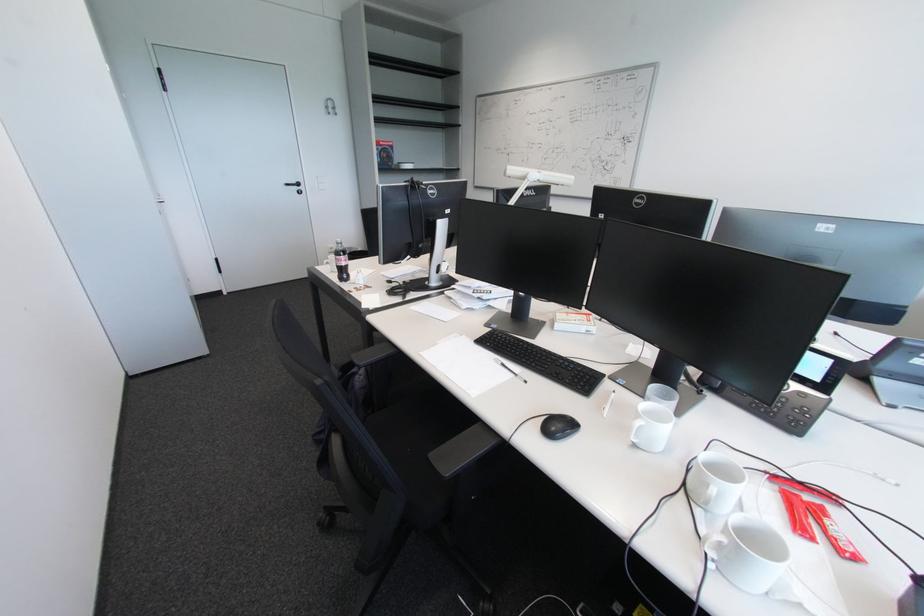
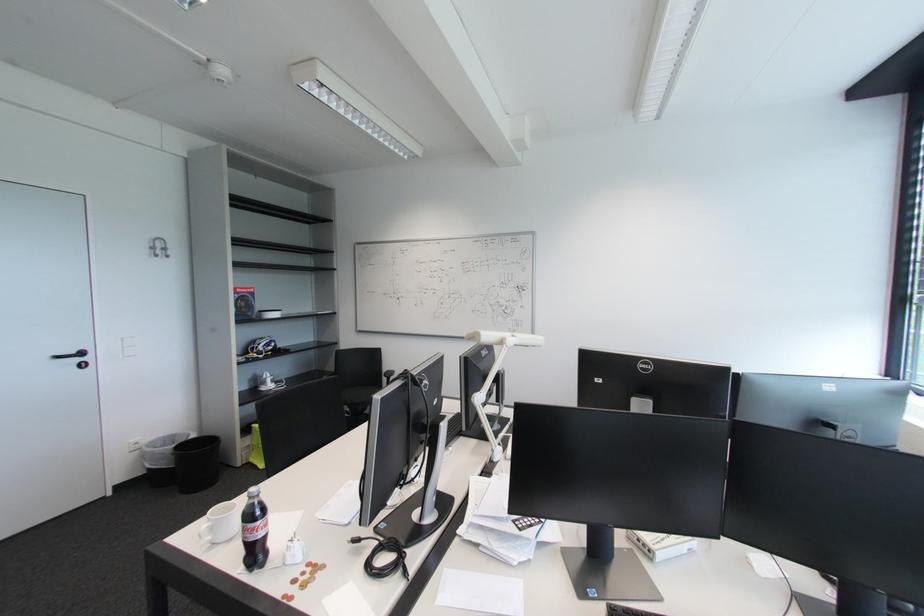
In the second image, find the point that corresponds to (x=335, y=269) in the first image.

(215, 539)